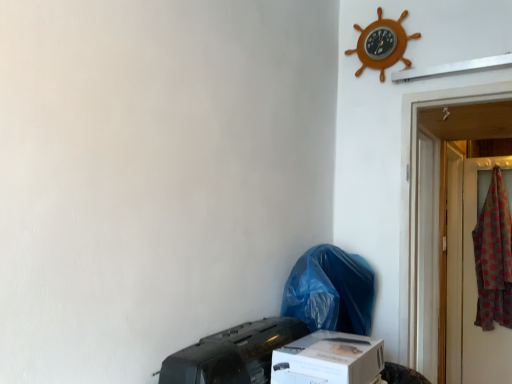
What do you see at coordinates (233, 354) in the screenshot?
I see `black matte printer at lower center` at bounding box center [233, 354].

Measure the distance between point (236, 343) and camera.

Point (236, 343) and camera are 3.42 feet apart.

Describe the element at coordinates (328, 359) in the screenshot. I see `white cardboard box at lower center` at that location.

This screenshot has height=384, width=512. Identify the location of black matte printer at lower center. (233, 354).

Is black matte printer at lower center in front of or behind polka dot fabric at right in the image?

black matte printer at lower center is positioned closer to the viewer than polka dot fabric at right.

Is black matte printer at lower center shorter than polka dot fabric at right?

Yes, black matte printer at lower center is shorter than polka dot fabric at right.

Is point (220, 364) in front of point (490, 317)?

Yes, it is.

From a real-world perspective, is black matte printer at lower center located beneath polka dot fabric at right?

Correct, in the physical world, black matte printer at lower center is lower than polka dot fabric at right.

Identify the location of curtain behind the blue plastic bag at lower center. (494, 257).

Could you tell me if blue plastic bag at lower center is facing polka dot fabric at right?

No, blue plastic bag at lower center does not turn towards polka dot fabric at right.

Considering the sizes of objects blue plastic bag at lower center and polka dot fabric at right in the image provided, who is bigger, blue plastic bag at lower center or polka dot fabric at right?

With larger size is polka dot fabric at right.

Visually, is black matte printer at lower center positioned to the left or to the right of white cardboard box at lower center?

Based on their positions, black matte printer at lower center is located to the left of white cardboard box at lower center.

From a real-world perspective, between black matte printer at lower center and white cardboard box at lower center, who is vertically higher?

From a 3D spatial view, black matte printer at lower center is above.

Is black matte printer at lower center located outside white cardboard box at lower center?

Yes, black matte printer at lower center is not within white cardboard box at lower center.

Does black matte printer at lower center lie in front of white cardboard box at lower center?

Yes, black matte printer at lower center is in front of white cardboard box at lower center.

Is point (323, 292) closer or farther from the camera than point (380, 58)?

Point (323, 292) is positioned closer to the camera compared to point (380, 58).

Does blue plastic bag at lower center have a lesser height compared to wooden ship wheel at upper right?

No.

Where is `waste in front of the wooden ship wheel at upper right`? waste in front of the wooden ship wheel at upper right is located at coordinates (331, 291).

From a real-world perspective, does blue plastic bag at lower center stand above wooden ship wheel at upper right?

No, from a real-world perspective, blue plastic bag at lower center is not over wooden ship wheel at upper right

Based on the photo, is wooden ship wheel at upper right at the back of white cardboard box at lower center?

white cardboard box at lower center does not have its back to wooden ship wheel at upper right.

Based on the photo, does white cardboard box at lower center lie behind wooden ship wheel at upper right?

No, the depth of white cardboard box at lower center is less than that of wooden ship wheel at upper right.

From a real-world perspective, is white cardboard box at lower center below wooden ship wheel at upper right?

Yes, from a real-world perspective, white cardboard box at lower center is below wooden ship wheel at upper right.

Does white cardboard box at lower center have a greater height compared to wooden ship wheel at upper right?

No.

Visually, is polka dot fabric at right positioned to the left or to the right of wooden ship wheel at upper right?

From the image, it's evident that polka dot fabric at right is to the right of wooden ship wheel at upper right.

In the scene shown: Between polka dot fabric at right and wooden ship wheel at upper right, which one has smaller width?

Thinner between the two is wooden ship wheel at upper right.

Does polka dot fabric at right have a larger size compared to wooden ship wheel at upper right?

Correct, polka dot fabric at right is larger in size than wooden ship wheel at upper right.

From a real-world perspective, relative to wooden ship wheel at upper right, is polka dot fabric at right vertically above or below?

polka dot fabric at right is below wooden ship wheel at upper right.

The width and height of the screenshot is (512, 384). I want to click on box below the blue plastic bag at lower center (from the image's perspective), so click(x=328, y=359).

From the image's perspective, is white cardboard box at lower center on top of blue plastic bag at lower center?

No, from the image's perspective, white cardboard box at lower center is not on top of blue plastic bag at lower center.

Between white cardboard box at lower center and blue plastic bag at lower center, which one has smaller width?

With smaller width is blue plastic bag at lower center.

How different are the orientations of white cardboard box at lower center and blue plastic bag at lower center in degrees?

white cardboard box at lower center and blue plastic bag at lower center are facing 4.74 degrees away from each other.

Locate an element on the screen. curtain behind the black matte printer at lower center is located at coordinates (494, 257).

The image size is (512, 384). What are the coordinates of `curtain above the blue plastic bag at lower center (from a real-world perspective)` in the screenshot? It's located at (494, 257).

Based on their spatial positions, is polka dot fabric at right or blue plastic bag at lower center closer to black matte printer at lower center?

blue plastic bag at lower center is closer to black matte printer at lower center.

Considering their positions, is polka dot fabric at right positioned further to wooden ship wheel at upper right than white cardboard box at lower center?

Based on the image, polka dot fabric at right appears to be further to wooden ship wheel at upper right.

From the image, which object appears to be nearer to white cardboard box at lower center, polka dot fabric at right or black matte printer at lower center?

Based on the image, black matte printer at lower center appears to be nearer to white cardboard box at lower center.

Looking at the image, which one is located closer to polka dot fabric at right, wooden ship wheel at upper right or white cardboard box at lower center?

wooden ship wheel at upper right is closer to polka dot fabric at right.

Which object lies further to the anchor point polka dot fabric at right, wooden ship wheel at upper right or black matte printer at lower center?

The object further to polka dot fabric at right is black matte printer at lower center.

From the image, which object appears to be nearer to blue plastic bag at lower center, white cardboard box at lower center or polka dot fabric at right?

white cardboard box at lower center is positioned closer to the anchor blue plastic bag at lower center.

When comparing their distances from wooden ship wheel at upper right, does black matte printer at lower center or polka dot fabric at right seem further?

The object further to wooden ship wheel at upper right is polka dot fabric at right.

From the image, which object appears to be farther from white cardboard box at lower center, black matte printer at lower center or blue plastic bag at lower center?

blue plastic bag at lower center is positioned further to the anchor white cardboard box at lower center.

Where is `printer between wooden ship wheel at upper right and white cardboard box at lower center in the vertical direction`? This screenshot has width=512, height=384. printer between wooden ship wheel at upper right and white cardboard box at lower center in the vertical direction is located at coordinates (233, 354).

Identify the location of box between black matte printer at lower center and blue plastic bag at lower center in the front-back direction. (328, 359).

Identify the location of waste located between white cardboard box at lower center and polka dot fabric at right in the depth direction. The height and width of the screenshot is (384, 512). (331, 291).

Image resolution: width=512 pixels, height=384 pixels. I want to click on box positioned between black matte printer at lower center and polka dot fabric at right from near to far, so click(328, 359).